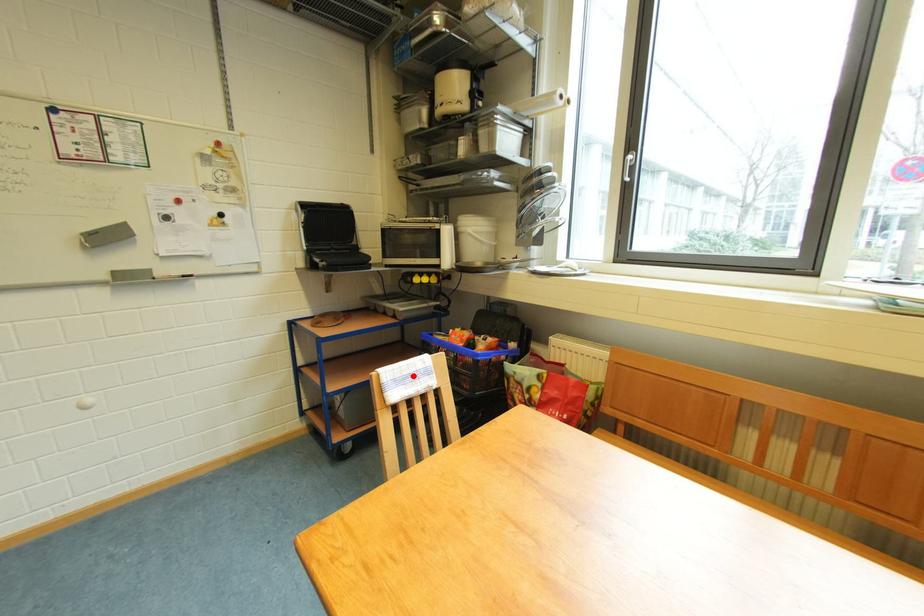
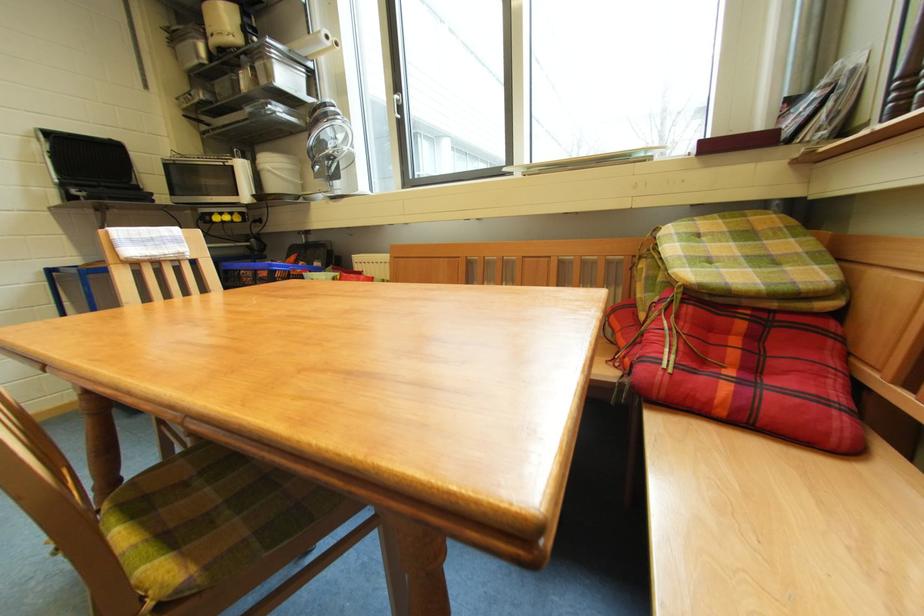
Locate, in the second image, the point that corresponds to the highlighted location in the first image.

(153, 238)